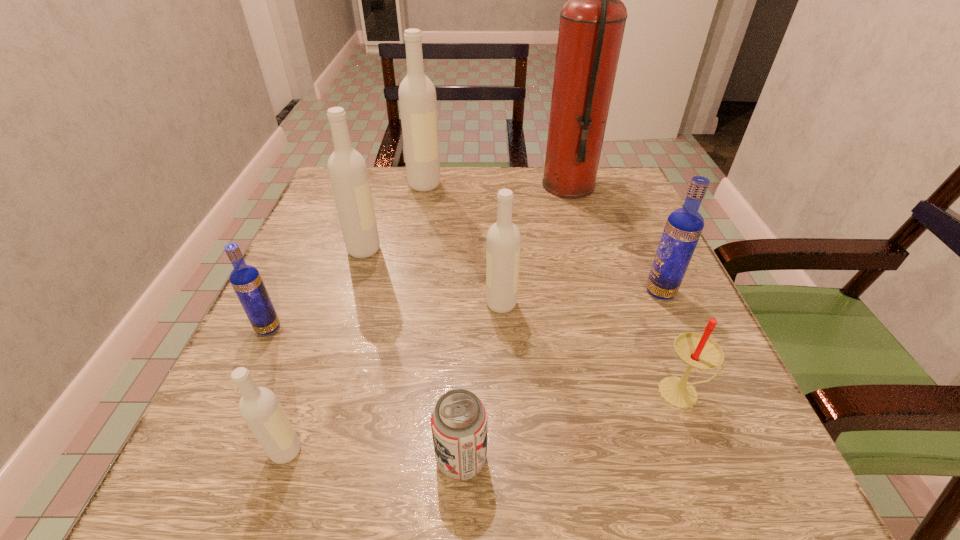
Where is `vodka that is at the near edge`? This screenshot has width=960, height=540. vodka that is at the near edge is located at coordinates (259, 407).

This screenshot has width=960, height=540. In order to click on beer can present at the near edge in this screenshot , I will do `click(459, 419)`.

The height and width of the screenshot is (540, 960). What are the coordinates of `fire extinguisher present at the right edge` in the screenshot? It's located at (592, 22).

Find the location of a particular element. This screenshot has height=540, width=960. vodka positioned at the right edge is located at coordinates (684, 226).

This screenshot has height=540, width=960. Find the location of `candle that is at the right edge`. candle that is at the right edge is located at coordinates (697, 350).

You are a GUI agent. You are given a task and a screenshot of the screen. Output one action in this format:
    pyautogui.click(x=<x>, y=<y>)
    Task: Click on the object at the near left corner
    Image resolution: width=960 pixels, height=540 pixels.
    Given the screenshot: What is the action you would take?
    pyautogui.click(x=259, y=407)

Locate an element on the screen. The width and height of the screenshot is (960, 540). object positioned at the far right corner is located at coordinates (592, 22).

The image size is (960, 540). What are the coordinates of `free space at the far edge of the desktop` in the screenshot? It's located at (457, 170).

What are the coordinates of `vacant space at the near edge of the desktop` in the screenshot? It's located at (323, 461).

Find the location of a particular element. This screenshot has height=540, width=960. free space at the left edge is located at coordinates (255, 370).